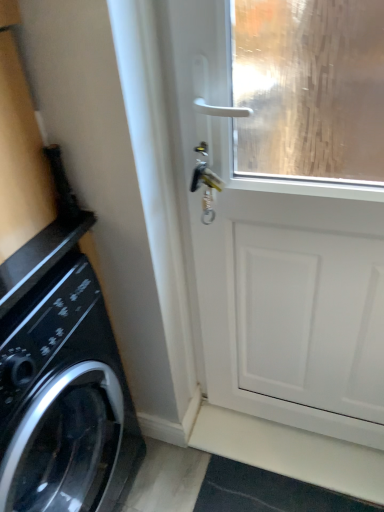
This screenshot has height=512, width=384. What do you see at coordinates (65, 401) in the screenshot? I see `black glossy washing machine at left` at bounding box center [65, 401].

Locate an element on the screen. Image resolution: width=384 pixels, height=512 pixels. black glossy washing machine at left is located at coordinates (65, 401).

At what (x,y) coordinates should I click in order to perform the action: click on black glossy washing machine at left. Please return your answer as a coordinate pair (x, y). The width and height of the screenshot is (384, 512). Looking at the image, I should click on (65, 401).